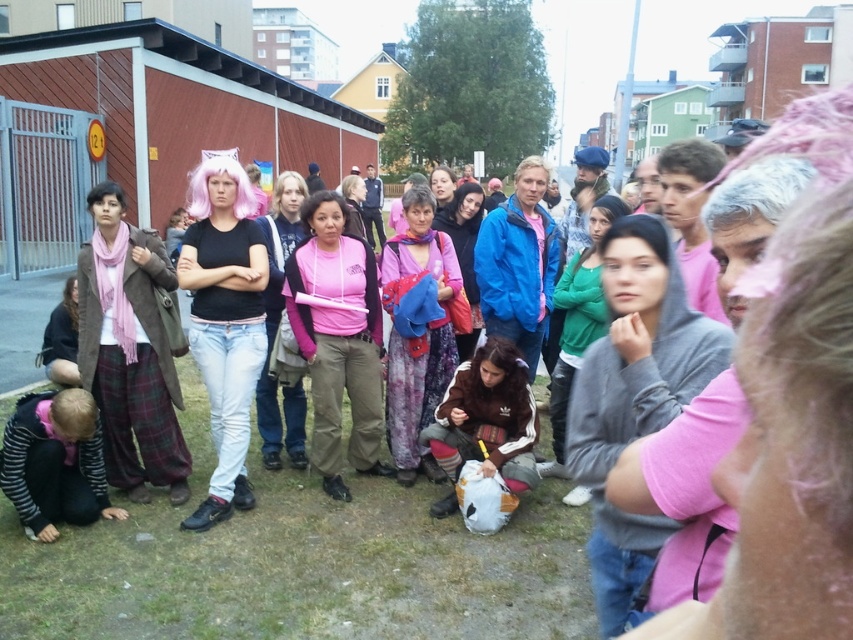
You are a fashion designer observing the group of people in the image. You notice two individuals wearing a pink fabric shirt at center and a brown fleece jacket at center. Which clothing item is taller?

The pink fabric shirt at center is taller than the brown fleece jacket at center.

From the picture: You are organizing a clothing donation drive and need to determine which of the two items takes up more space in a donation box. Which item between the pink fabric shirt at center and the brown fleece jacket at center occupies more space?

The brown fleece jacket at center occupies more space in the donation box because it has a greater width than the pink fabric shirt at center.